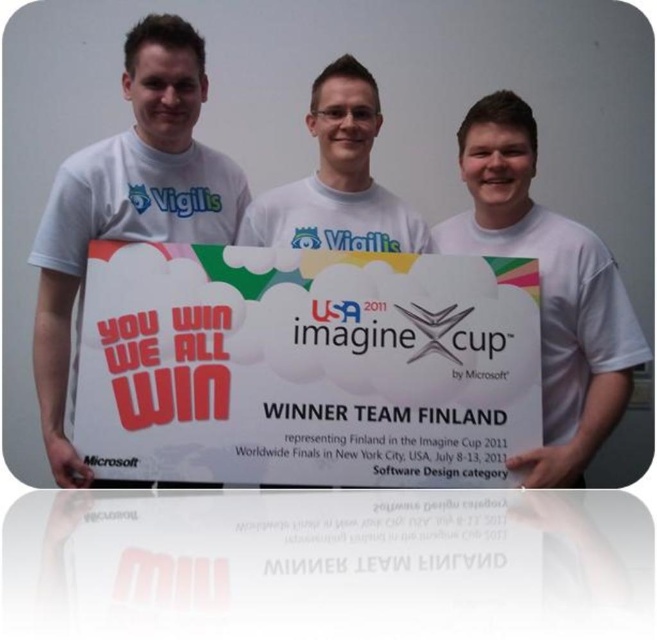
Describe the element at coordinates (127, 202) in the screenshot. I see `white matte t-shirt at left` at that location.

Measure the distance from white matte t-shirt at left to white t-shirt at center.

A distance of 34.92 inches exists between white matte t-shirt at left and white t-shirt at center.

Who is more distant from viewer, (233, 186) or (522, 228)?

Positioned behind is point (233, 186).

Locate an element on the screen. white matte t-shirt at left is located at coordinates (127, 202).

Is white t-shirt at center to the right of white matte t-shirt at center from the viewer's perspective?

Correct, you'll find white t-shirt at center to the right of white matte t-shirt at center.

Which of these two, white t-shirt at center or white matte t-shirt at center, stands shorter?

Standing shorter between the two is white matte t-shirt at center.

Where is `white t-shirt at center`? This screenshot has height=640, width=657. white t-shirt at center is located at coordinates 549,289.

Identify the location of white t-shirt at center. (549, 289).

Which is in front, point (426, 353) or point (267, 241)?

Point (426, 353)

Which of these two, white paper sign at center or white matte t-shirt at center, stands shorter?

white matte t-shirt at center is shorter.

Who is more distant from viewer, (200, 474) or (313, 176)?

Point (313, 176)

The width and height of the screenshot is (657, 640). I want to click on white paper sign at center, so click(306, 365).